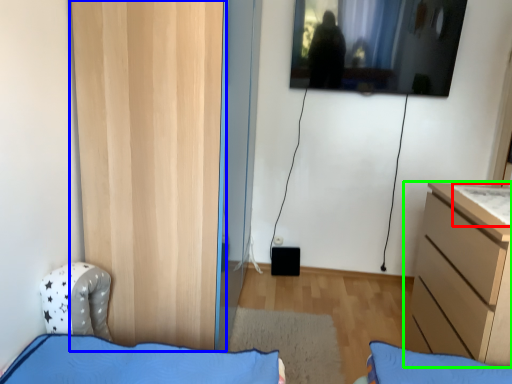
Question: Which is farther away from sheet (highlighted by a red box)? door (highlighted by a blue box) or chest of drawers (highlighted by a green box)?

Choices:
 (A) door
 (B) chest of drawers

Answer: (A)